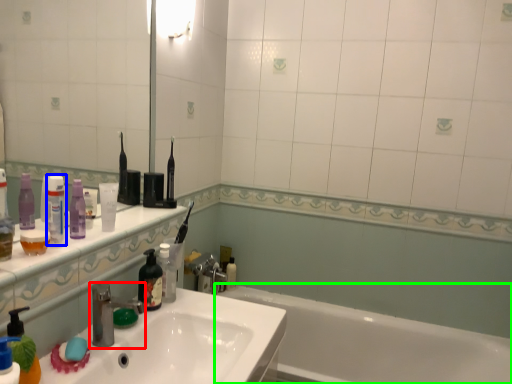
Question: Which object is positioned farthest from tap (highlighted by a red box)? Select from toiletry (highlighted by a blue box) and bathtub (highlighted by a green box).

Choices:
 (A) toiletry
 (B) bathtub

Answer: (B)